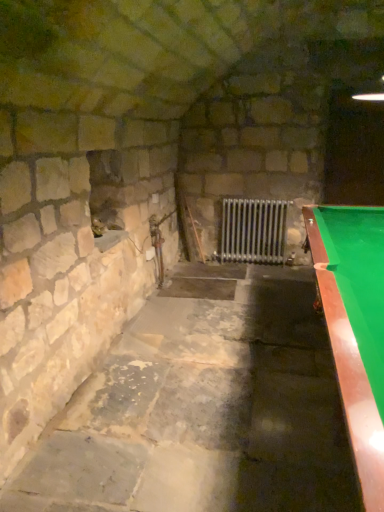
Question: Does point (258, 239) appear closer or farther from the camera than point (357, 317)?

Choices:
 (A) farther
 (B) closer

Answer: (A)

Question: Considering the positions of metallic silver radiator at center and green felt pool table at right in the image, is metallic silver radiator at center taller or shorter than green felt pool table at right?

Choices:
 (A) tall
 (B) short

Answer: (B)

Question: Visually, is metallic silver radiator at center positioned to the left or to the right of green felt pool table at right?

Choices:
 (A) right
 (B) left

Answer: (B)

Question: Choose the correct answer: Is green felt pool table at right inside metallic silver radiator at center or outside it?

Choices:
 (A) inside
 (B) outside

Answer: (B)

Question: Is point (311, 238) positioned closer to the camera than point (228, 246)?

Choices:
 (A) closer
 (B) farther

Answer: (A)

Question: Is green felt pool table at right bigger or smaller than metallic silver radiator at center?

Choices:
 (A) small
 (B) big

Answer: (B)

Question: From the image's perspective, is green felt pool table at right located above or below metallic silver radiator at center?

Choices:
 (A) below
 (B) above

Answer: (A)